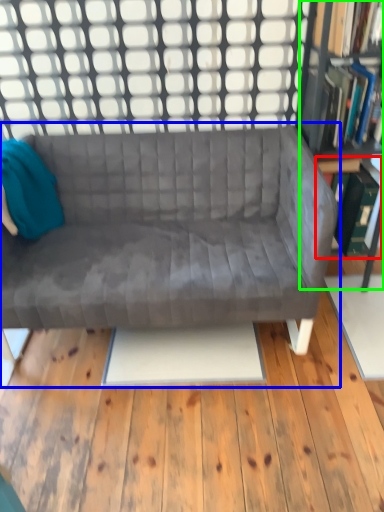
Question: Based on their relative distances, which object is nearer to shelf (highlighted by a red box)? Choose from studio couch (highlighted by a blue box) and bookcase (highlighted by a green box).

Choices:
 (A) studio couch
 (B) bookcase

Answer: (B)